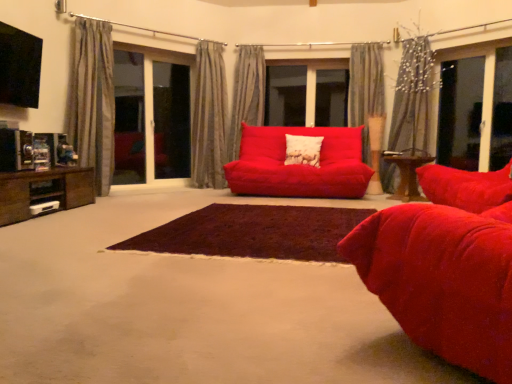
Question: Is dark brown shaggy rug at center spatially inside transparent glass screen door at left, which is the first screen door from left to right, or outside of it?

Choices:
 (A) inside
 (B) outside

Answer: (B)

Question: Would you say dark brown shaggy rug at center is to the left or to the right of transparent glass screen door at left, marked as the second screen door in a right-to-left arrangement, in the picture?

Choices:
 (A) left
 (B) right

Answer: (B)

Question: Based on their relative distances, which object is farther from the matte red couch at center?

Choices:
 (A) velvet red studio couch at center
 (B) white textured pillow at center
 (C) transparent glass screen door at left, arranged as the 2th screen door when viewed from the left
 (D) transparent glass screen door at left, which is the first screen door from left to right
 (E) wooden table at center, which is counted as the 2th table, starting from the front

Answer: (C)

Question: Estimate the real-world distances between objects in this image. Which object is farther from the velvet red studio couch at center?

Choices:
 (A) transparent glass screen door at left, arranged as the 2th screen door when viewed from the left
 (B) transparent glass window at right
 (C) matte red couch at center
 (D) brown wood entertainment unit at left, which is the first table in left-to-right order
 (E) gray textured curtain at left, the 5th curtain when ordered from right to left

Answer: (B)